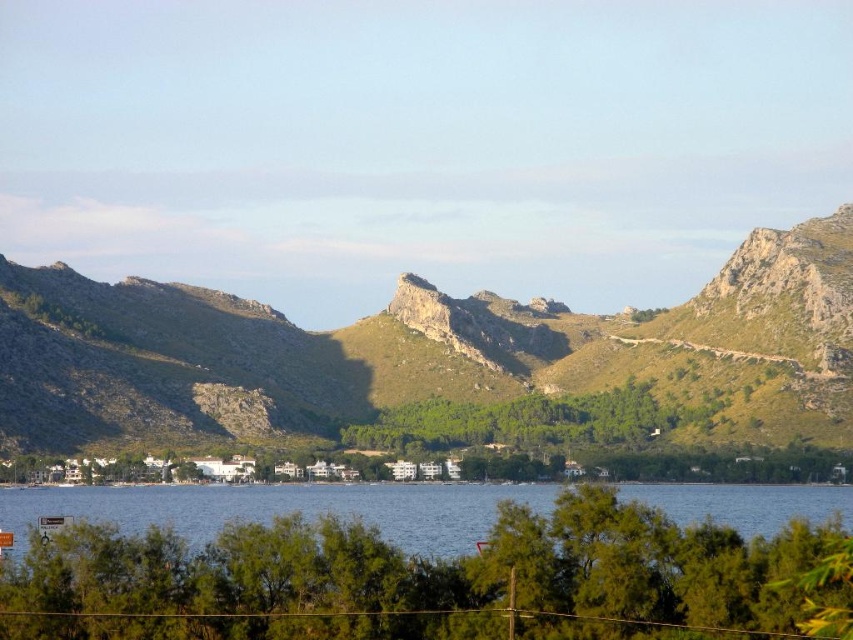
Can you confirm if green grassy mountain at center is positioned above blue water at center?

Yes, green grassy mountain at center is above blue water at center.

Who is lower down, green grassy mountain at center or blue water at center?

Positioned lower is blue water at center.

Is point (51, 381) in front of point (45, 506)?

No, it is not.

Locate an element on the screen. The width and height of the screenshot is (853, 640). green grassy mountain at center is located at coordinates coord(428,353).